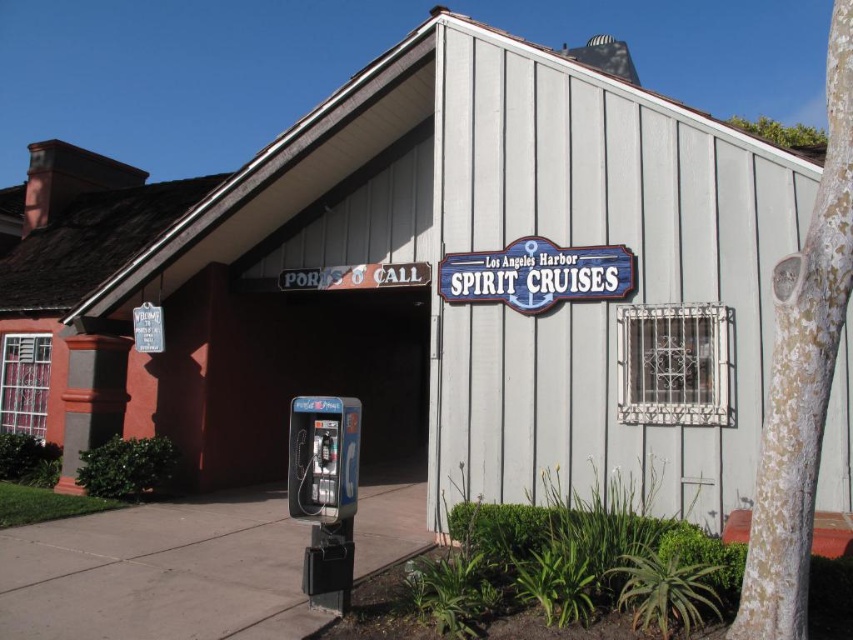
Question: Is gray concrete sidewalk at lower left to the left of blue wooden sign at upper center from the viewer's perspective?

Choices:
 (A) yes
 (B) no

Answer: (A)

Question: Is gray concrete sidewalk at lower left smaller than blue wooden sign at upper center?

Choices:
 (A) yes
 (B) no

Answer: (A)

Question: Which object is positioned closest to the metallic gray parking meter at lower left?

Choices:
 (A) blue wooden sign at upper center
 (B) gray concrete sidewalk at lower left

Answer: (B)

Question: Which point is closer to the camera taking this photo?

Choices:
 (A) (358, 401)
 (B) (462, 259)

Answer: (B)

Question: Is gray concrete sidewalk at lower left below blue wooden sign at upper center?

Choices:
 (A) yes
 (B) no

Answer: (A)

Question: Which point is farther to the camera?

Choices:
 (A) gray concrete sidewalk at lower left
 (B) blue wooden sign at upper center
 (C) metallic gray parking meter at lower left

Answer: (B)